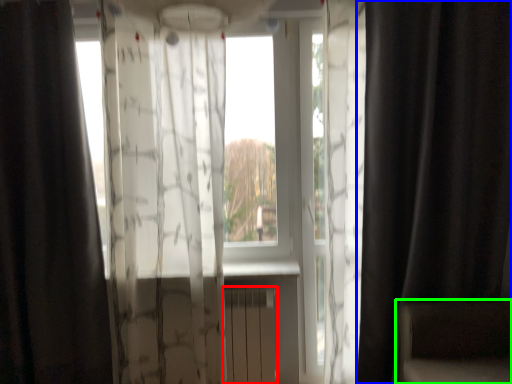
Question: Which object is positioned closest to radiator (highlighted by a red box)? Select from curtain (highlighted by a blue box) and armchair (highlighted by a green box).

Choices:
 (A) curtain
 (B) armchair

Answer: (B)